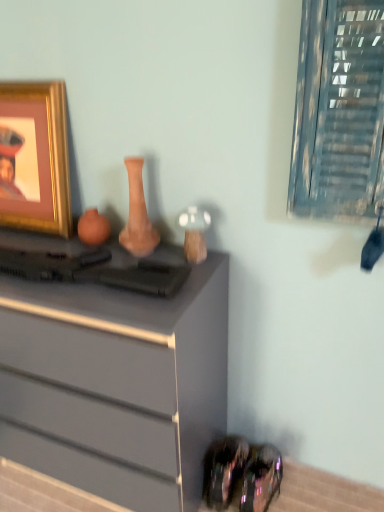
Question: Does metallic glass window at upper right have a lesser width compared to matte gray chest of drawers at center?

Choices:
 (A) yes
 (B) no

Answer: (A)

Question: From the image's perspective, is metallic glass window at upper right below matte gray chest of drawers at center?

Choices:
 (A) yes
 (B) no

Answer: (B)

Question: Considering the relative sizes of metallic glass window at upper right and matte gray chest of drawers at center in the image provided, is metallic glass window at upper right shorter than matte gray chest of drawers at center?

Choices:
 (A) no
 (B) yes

Answer: (B)

Question: Can you confirm if metallic glass window at upper right is wider than matte gray chest of drawers at center?

Choices:
 (A) no
 (B) yes

Answer: (A)

Question: Is metallic glass window at upper right not near matte gray chest of drawers at center?

Choices:
 (A) yes
 (B) no

Answer: (B)

Question: From a real-world perspective, is matte clay vase at center above or below gold metallic picture frame at upper left?

Choices:
 (A) below
 (B) above

Answer: (A)

Question: In terms of width, does matte clay vase at center look wider or thinner when compared to gold metallic picture frame at upper left?

Choices:
 (A) thin
 (B) wide

Answer: (B)

Question: Considering their positions, is matte clay vase at center located in front of or behind gold metallic picture frame at upper left?

Choices:
 (A) front
 (B) behind

Answer: (A)

Question: Is matte clay vase at center inside or outside of gold metallic picture frame at upper left?

Choices:
 (A) outside
 (B) inside

Answer: (A)

Question: In terms of height, does metallic glass window at upper right look taller or shorter compared to shiny black shoe at lower right?

Choices:
 (A) short
 (B) tall

Answer: (B)

Question: From the image's perspective, is metallic glass window at upper right above or below shiny black shoe at lower right?

Choices:
 (A) above
 (B) below

Answer: (A)

Question: Do you think metallic glass window at upper right is within shiny black shoe at lower right, or outside of it?

Choices:
 (A) inside
 (B) outside

Answer: (B)

Question: In the image, is metallic glass window at upper right positioned in front of or behind shiny black shoe at lower right?

Choices:
 (A) behind
 (B) front

Answer: (B)

Question: From their relative heights in the image, would you say gold metallic picture frame at upper left is taller or shorter than metallic glass window at upper right?

Choices:
 (A) short
 (B) tall

Answer: (B)

Question: Is gold metallic picture frame at upper left spatially inside metallic glass window at upper right, or outside of it?

Choices:
 (A) outside
 (B) inside

Answer: (A)